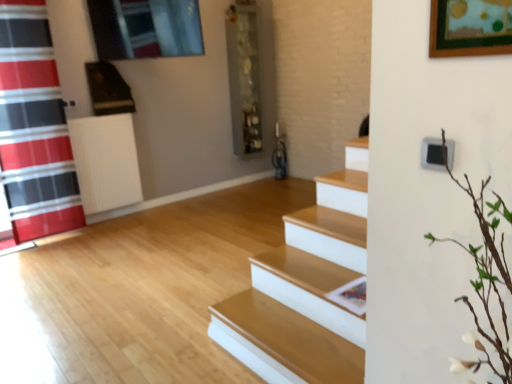
Question: Is point (47, 173) closer or farther from the camera than point (259, 46)?

Choices:
 (A) closer
 (B) farther

Answer: (A)

Question: Is red plaid shower curtain at left wider or thinner than metallic gray shelf at center?

Choices:
 (A) wide
 (B) thin

Answer: (B)

Question: Which of these objects is positioned closest to the red plaid shower curtain at left?

Choices:
 (A) metallic gray shelf at center
 (B) white plastic radiator at left

Answer: (B)

Question: Based on their relative distances, which object is farther from the red plaid shower curtain at left?

Choices:
 (A) metallic gray shelf at center
 (B) white plastic radiator at left

Answer: (A)